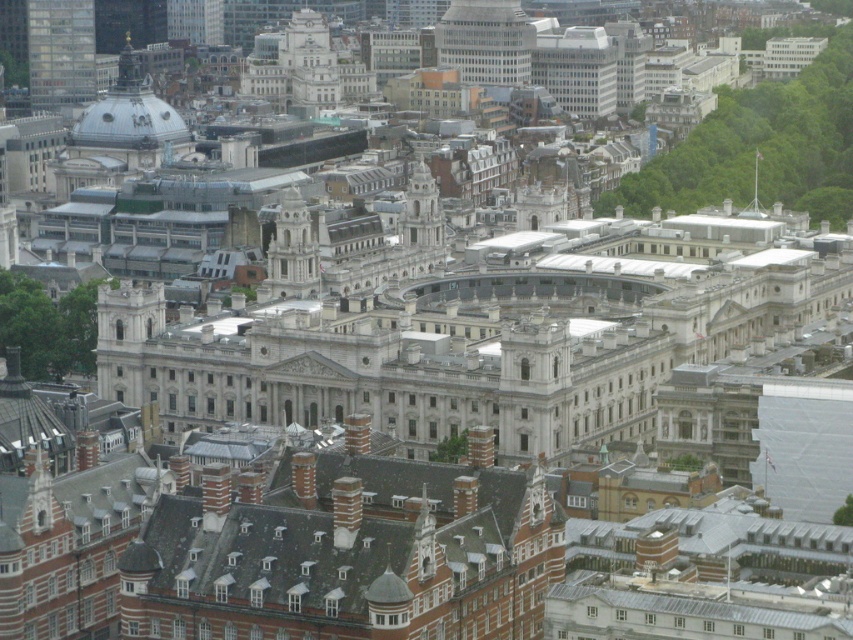
Is point (454, 49) behind point (314, 296)?

Yes, it is.

Who is more distant from viewer, (531, 36) or (306, 276)?

The point (531, 36) is behind.

Which is behind, point (469, 13) or point (277, 208)?

Point (469, 13)

You are a GUI agent. You are given a task and a screenshot of the screen. Output one action in this format:
    pyautogui.click(x=<x>, y=<y>)
    Task: Click on the white glass tower at center
    The image size is (853, 640).
    Given the screenshot: What is the action you would take?
    pyautogui.click(x=485, y=42)